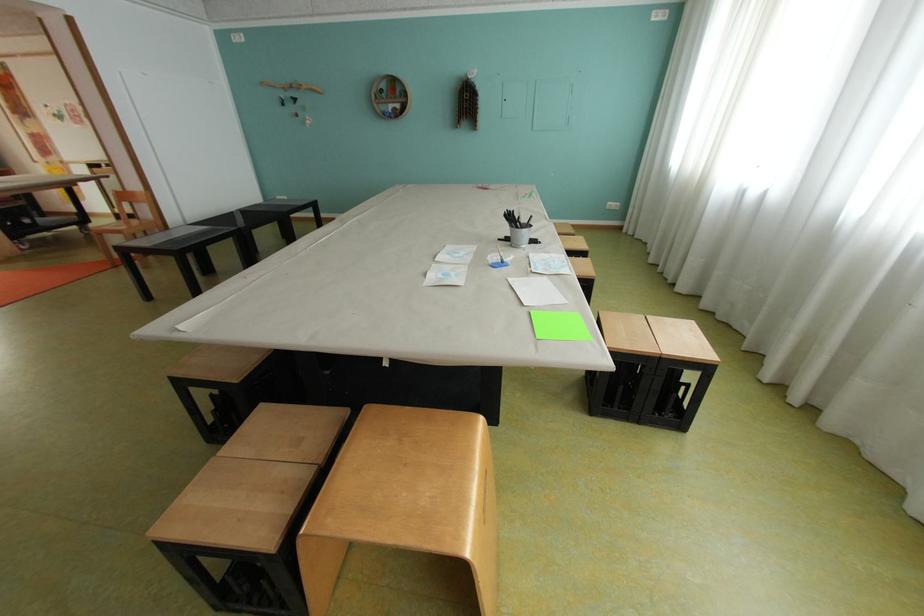
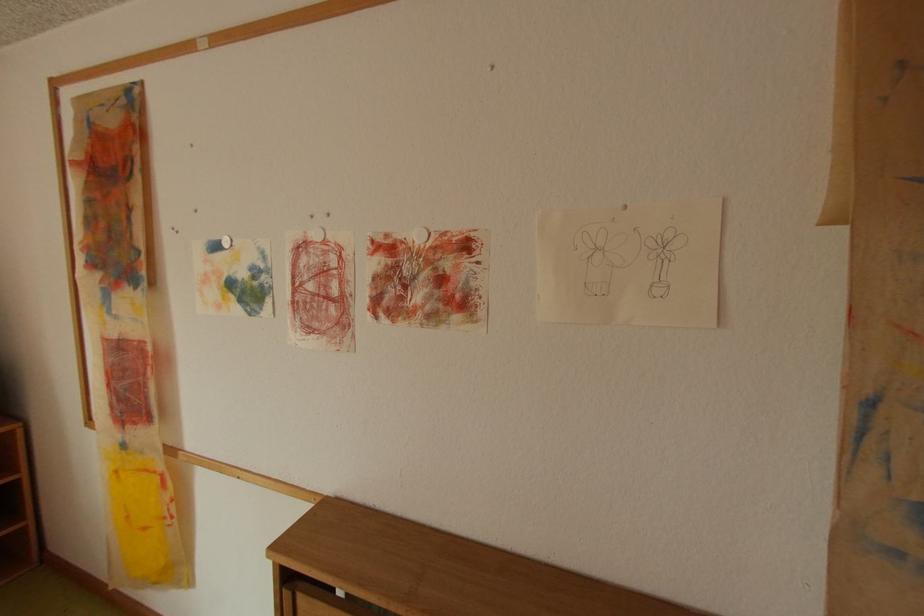
In the second image, find the point that corresponds to point (58, 163) in the first image.

(134, 446)